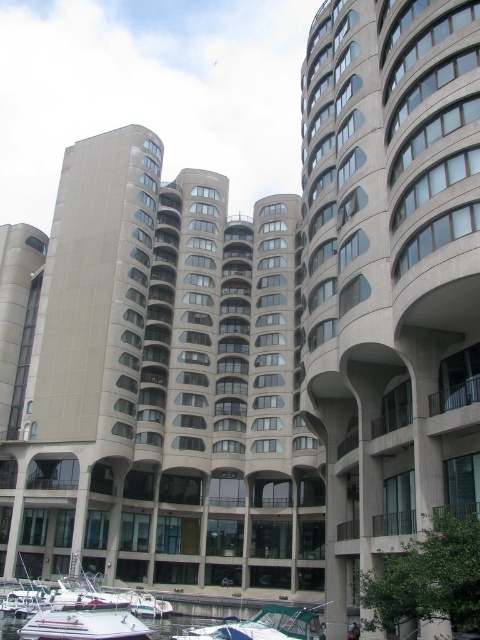
Question: Among these points, which one is nearest to the camera?

Choices:
 (A) (91, 611)
 (B) (256, 634)

Answer: (B)

Question: Which of the following is the closest to the observer?

Choices:
 (A) (229, 493)
 (B) (399, 141)
 (C) (266, 612)
 (D) (41, 627)

Answer: (B)

Question: Does gray concrete building at center have a greater width compared to white matte boat at lower left?

Choices:
 (A) yes
 (B) no

Answer: (A)

Question: Is gray concrete building at center further to camera compared to white glossy boat at lower center?

Choices:
 (A) no
 (B) yes

Answer: (B)

Question: Is matte concrete building at center further to camera compared to white matte boat at lower left?

Choices:
 (A) yes
 (B) no

Answer: (B)

Question: Which object is the farthest from the matte concrete building at center?

Choices:
 (A) white glossy boat at lower center
 (B) white matte boat at lower left
 (C) gray concrete building at center

Answer: (B)